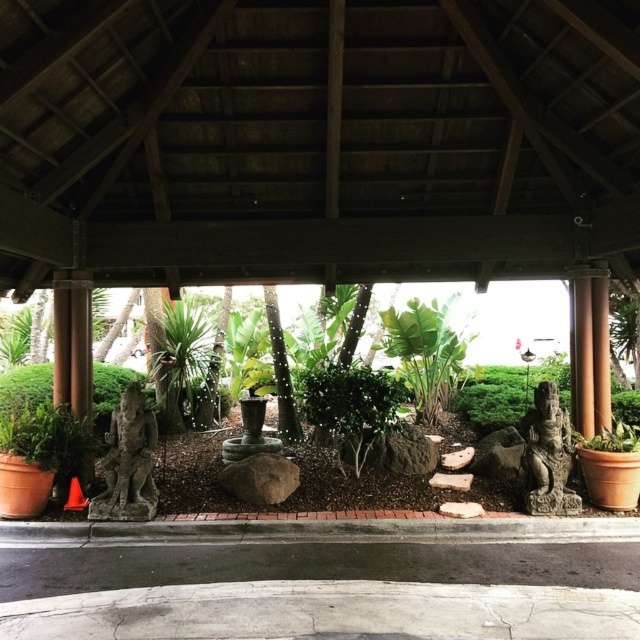
Question: Which object is farther from the camera taking this photo?

Choices:
 (A) stone statue at center
 (B) gray stone statue at lower left

Answer: (A)

Question: Can you confirm if gray stone statue at lower left is bigger than stone statue at center?

Choices:
 (A) no
 (B) yes

Answer: (A)

Question: Which point is closer to the camera?

Choices:
 (A) stone statue at center
 (B) gray stone statue at lower left

Answer: (B)

Question: Where is gray stone statue at lower left located in relation to stone statue at center in the image?

Choices:
 (A) left
 (B) right

Answer: (A)

Question: Can you confirm if gray stone statue at lower left is positioned above stone statue at center?

Choices:
 (A) yes
 (B) no

Answer: (B)